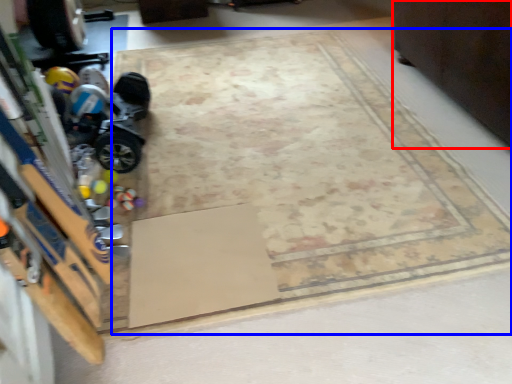
Question: Which point is closer to the camera, furniture (highlighted by a red box) or mat (highlighted by a blue box)?

Choices:
 (A) furniture
 (B) mat

Answer: (B)